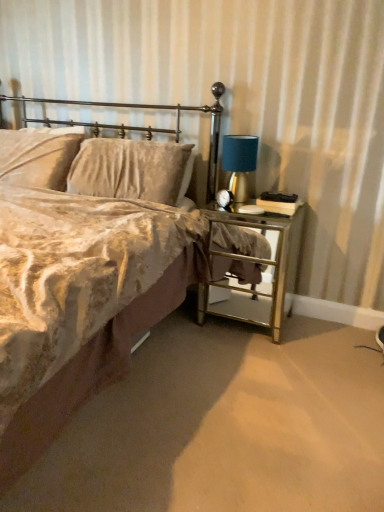
Question: Does velvet beige bed at center lie in front of metallic gold headboard at upper left?

Choices:
 (A) no
 (B) yes

Answer: (B)

Question: From a real-world perspective, does velvet beige bed at center sit lower than metallic gold headboard at upper left?

Choices:
 (A) yes
 (B) no

Answer: (A)

Question: Would you say velvet beige bed at center contains metallic gold headboard at upper left?

Choices:
 (A) no
 (B) yes

Answer: (B)

Question: From the image's perspective, does velvet beige bed at center appear higher than metallic gold headboard at upper left?

Choices:
 (A) no
 (B) yes

Answer: (A)

Question: Is velvet beige bed at center not within metallic gold headboard at upper left?

Choices:
 (A) no
 (B) yes

Answer: (B)

Question: Is velvet beige bed at center placed right next to metallic gold headboard at upper left?

Choices:
 (A) no
 (B) yes

Answer: (A)

Question: Is metallic gold headboard at upper left located outside velvet beige pillow at upper left, which appears as the first pillow when viewed from the left?

Choices:
 (A) no
 (B) yes

Answer: (B)

Question: Can velvet beige pillow at upper left, which appears as the first pillow when viewed from the left, be found inside metallic gold headboard at upper left?

Choices:
 (A) no
 (B) yes

Answer: (A)

Question: Is metallic gold headboard at upper left bigger than velvet beige pillow at upper left, which appears as the first pillow when viewed from the left?

Choices:
 (A) no
 (B) yes

Answer: (B)

Question: Considering the relative positions of metallic gold headboard at upper left and velvet beige pillow at upper left, the 2th pillow when ordered from right to left, in the image provided, is metallic gold headboard at upper left to the left of velvet beige pillow at upper left, the 2th pillow when ordered from right to left, from the viewer's perspective?

Choices:
 (A) yes
 (B) no

Answer: (B)

Question: Considering the relative sizes of metallic gold headboard at upper left and velvet beige pillow at upper left, which appears as the first pillow when viewed from the left, in the image provided, is metallic gold headboard at upper left smaller than velvet beige pillow at upper left, which appears as the first pillow when viewed from the left,?

Choices:
 (A) yes
 (B) no

Answer: (B)

Question: Is metallic gold headboard at upper left not near velvet beige pillow at upper left, which appears as the first pillow when viewed from the left?

Choices:
 (A) yes
 (B) no

Answer: (B)

Question: From a real-world perspective, is blue fabric lampshade at right positioned over gold mirrored nightstand at right based on gravity?

Choices:
 (A) yes
 (B) no

Answer: (A)